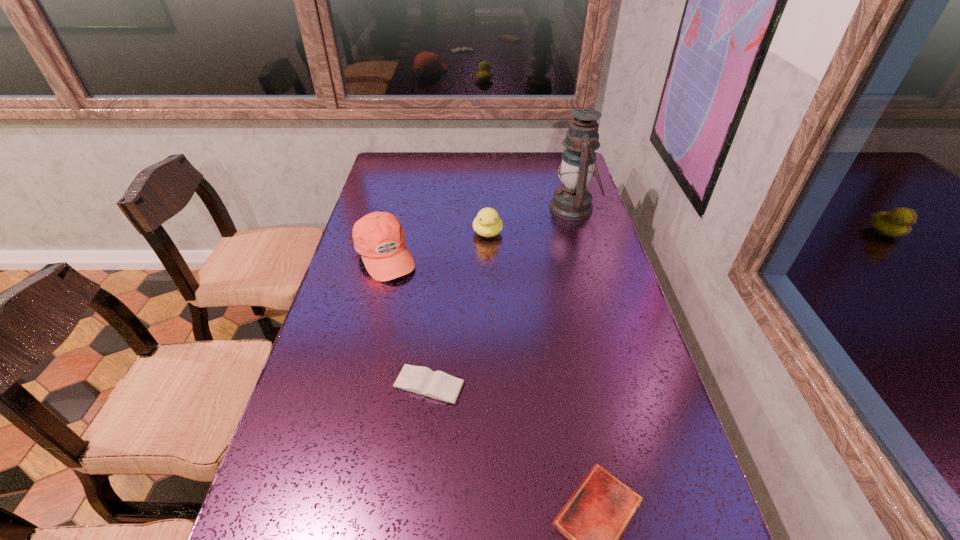
Identify the location of object at the left edge. This screenshot has height=540, width=960. (379, 238).

You are a GUI agent. You are given a task and a screenshot of the screen. Output one action in this format:
    pyautogui.click(x=<x>, y=<y>)
    Task: Click on the object located in the right edge section of the desktop
    
    Given the screenshot: What is the action you would take?
    572,201

Where is `vacant space at the far edge of the desktop`? The image size is (960, 540). vacant space at the far edge of the desktop is located at coordinates (433, 154).

The image size is (960, 540). In order to click on free region at the left edge in this screenshot , I will do `click(306, 382)`.

Where is `vacant space at the right edge of the desktop`? vacant space at the right edge of the desktop is located at coordinates (608, 282).

Locate an element on the screen. Image resolution: width=960 pixels, height=540 pixels. vacant space at the far left corner of the desktop is located at coordinates (412, 171).

Image resolution: width=960 pixels, height=540 pixels. In order to click on unoccupied position between the third shortest object and the fourth shortest object in this screenshot , I will do `click(435, 245)`.

I want to click on empty space that is in between the farther diary and the oil lamp, so click(x=501, y=296).

Where is `free space between the third shortest object and the tallest object`? free space between the third shortest object and the tallest object is located at coordinates click(x=531, y=220).

I want to click on vacant space that is in between the baseball cap and the second nearest object, so click(406, 321).